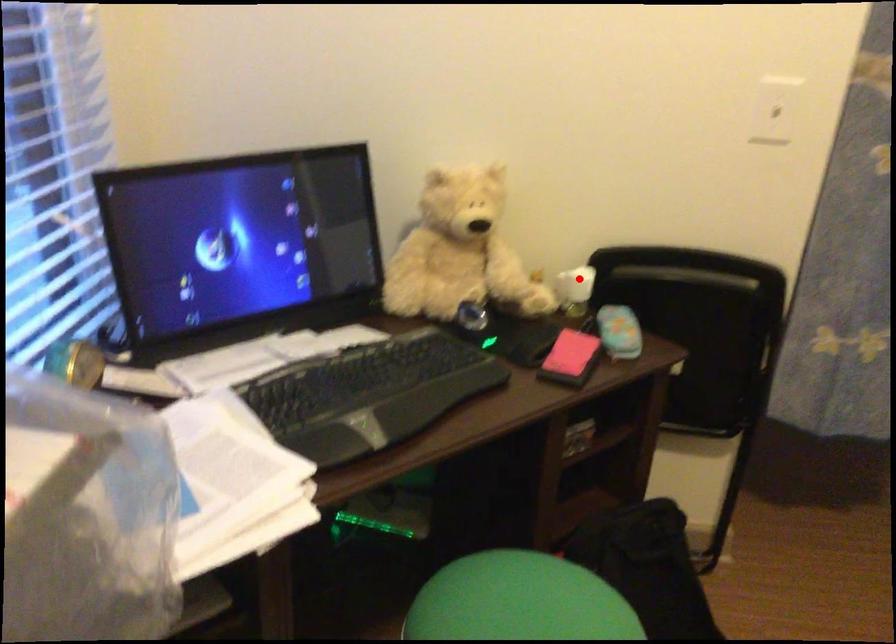
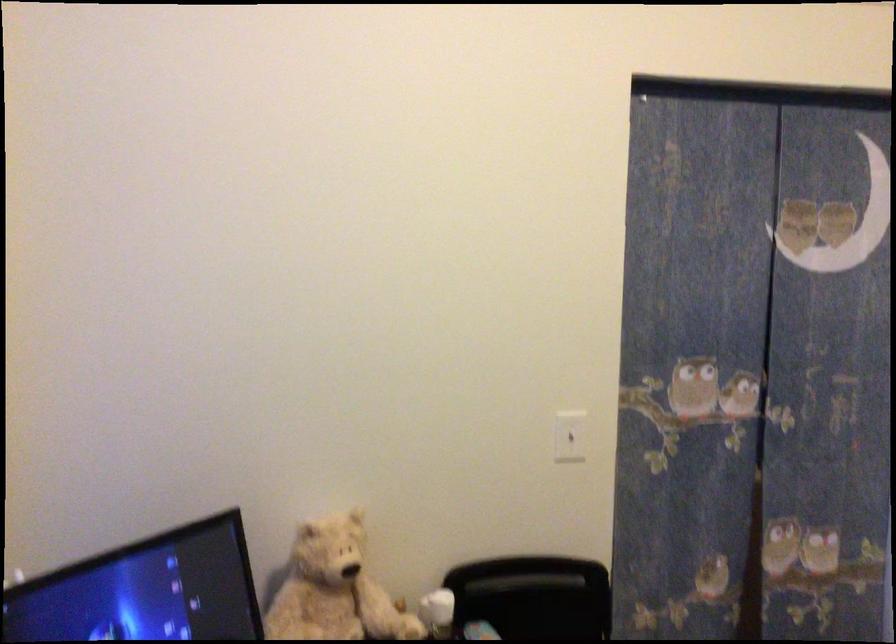
Question: I am providing you with two images of the same scene from different viewpoints. Given a red point in image1, look at the same physical point in image2. Is it:

Choices:
 (A) Closer to the viewpoint
 (B) Farther from the viewpoint

Answer: (B)